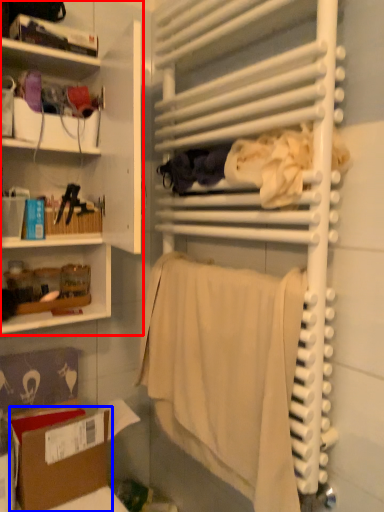
Question: Which object appears farthest to the camera in this image, shelf (highlighted by a red box) or cardboard box (highlighted by a blue box)?

Choices:
 (A) shelf
 (B) cardboard box

Answer: (B)